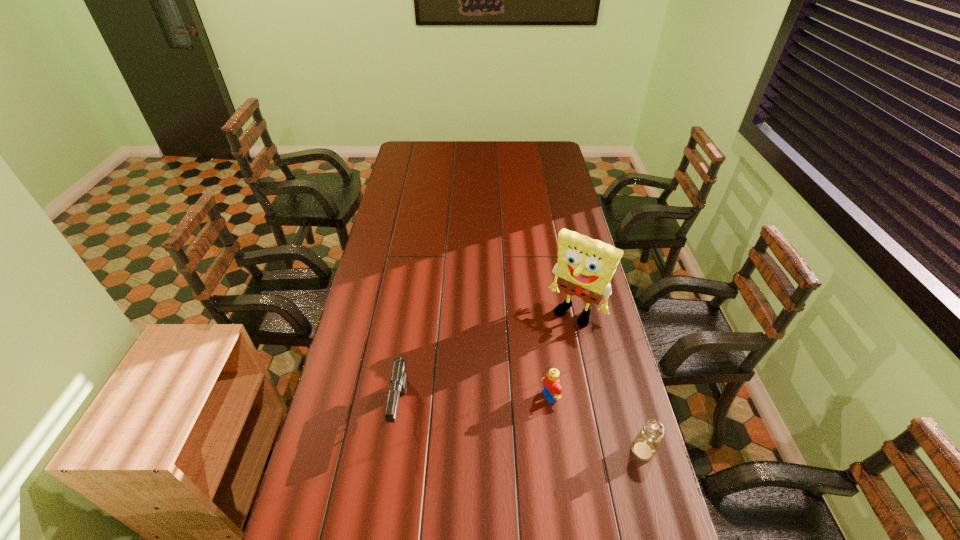
Identify the location of vacant space in between the second object from left to right and the saltshaker. The width and height of the screenshot is (960, 540). click(x=596, y=423).

Identify the location of object identified as the second closest to the Lego. (585, 267).

You are a GUI agent. You are given a task and a screenshot of the screen. Output one action in this format:
    pyautogui.click(x=<x>, y=<y>)
    Task: Click on the third closest object relative to the saltshaker
    This screenshot has height=540, width=960.
    Given the screenshot: What is the action you would take?
    pyautogui.click(x=399, y=381)

Locate an element on the screen. free location that satisfies the following two spatial constraints: 1. aim along the barrel of the pistol; 2. on the right side of the saltshaker is located at coordinates (395, 450).

What are the coordinates of `free space that satisfies the following two spatial constraints: 1. aim along the barrel of the saltshaker; 2. on the left side of the pistol` in the screenshot? It's located at (395, 450).

Where is `free space that satisfies the following two spatial constraints: 1. on the back side of the third object from right to left; 2. on the left side of the tallest object`? free space that satisfies the following two spatial constraints: 1. on the back side of the third object from right to left; 2. on the left side of the tallest object is located at coordinates (539, 312).

You are a GUI agent. You are given a task and a screenshot of the screen. Output one action in this format:
    pyautogui.click(x=<x>, y=<y>)
    Task: Click on the vacant area in the image that satisfies the following two spatial constraints: 1. on the back side of the sponge; 2. on the left side of the second object from left to right
    
    Given the screenshot: What is the action you would take?
    pyautogui.click(x=539, y=312)

What are the coordinates of `vacant point that satisfies the following two spatial constraints: 1. aim along the barrel of the saltshaker; 2. on the left side of the pistol` in the screenshot? It's located at (395, 450).